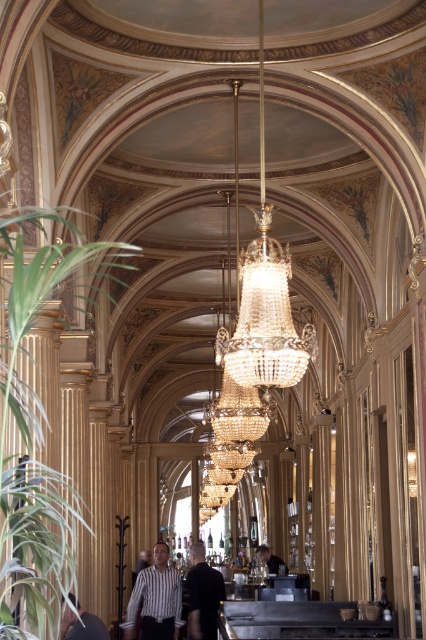
Question: Which point is farther from the camera taking this photo?

Choices:
 (A) (138, 577)
 (B) (215, 595)
 (C) (37, 500)

Answer: (B)

Question: Which point is closer to the camera taking this photo?

Choices:
 (A) (279, 561)
 (B) (198, 600)
 (C) (20, 257)
 (D) (88, 628)

Answer: (C)

Question: Considering the relative positions of green leafy plant at left and dark brown leather jacket at center in the image provided, where is green leafy plant at left located with respect to dark brown leather jacket at center?

Choices:
 (A) above
 (B) below

Answer: (A)

Question: Which point is closer to the camera taking this photo?

Choices:
 (A) (94, 634)
 (B) (273, 554)

Answer: (A)

Question: Is striped fabric shirt at lower left to the left of dark brown leather jacket at center from the viewer's perspective?

Choices:
 (A) yes
 (B) no

Answer: (A)

Question: In this image, where is green leafy plant at left located relative to dark brown leather jacket at center?

Choices:
 (A) left
 (B) right

Answer: (A)